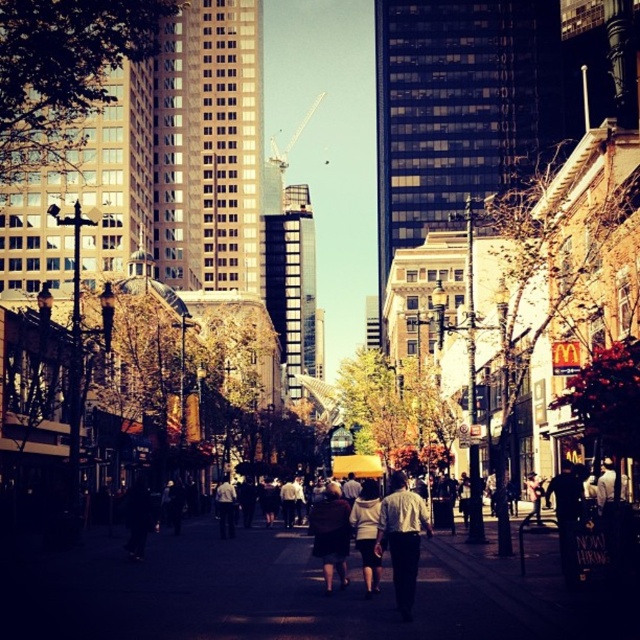
Locate an element on the screen. Image resolution: width=640 pixels, height=640 pixels. dark gray concrete sidewalk at center is located at coordinates (288, 593).

Does dark gray concrete sidewalk at center appear on the right side of light brown leather jacket at center?

Incorrect, dark gray concrete sidewalk at center is not on the right side of light brown leather jacket at center.

Measure the distance between point (273, 547) and camera.

A distance of 287.21 feet exists between point (273, 547) and camera.

Where is `dark gray concrete sidewalk at center`? The image size is (640, 640). dark gray concrete sidewalk at center is located at coordinates (288, 593).

Does light brown leather jacket at center have a greater width compared to dark brown leather jacket at center?

Yes.

Is point (400, 490) closer to camera compared to point (344, 563)?

Yes.

The height and width of the screenshot is (640, 640). What do you see at coordinates (403, 538) in the screenshot?
I see `light brown leather jacket at center` at bounding box center [403, 538].

The image size is (640, 640). I want to click on light brown leather jacket at center, so click(403, 538).

Is dark gray concrete sidewalk at center above dark brown leather jacket at center?

Actually, dark gray concrete sidewalk at center is below dark brown leather jacket at center.

The image size is (640, 640). I want to click on dark gray concrete sidewalk at center, so [x=288, y=593].

At what (x,y) coordinates should I click in order to perform the action: click on dark gray concrete sidewalk at center. Please return your answer as a coordinate pair (x, y). The height and width of the screenshot is (640, 640). Looking at the image, I should click on 288,593.